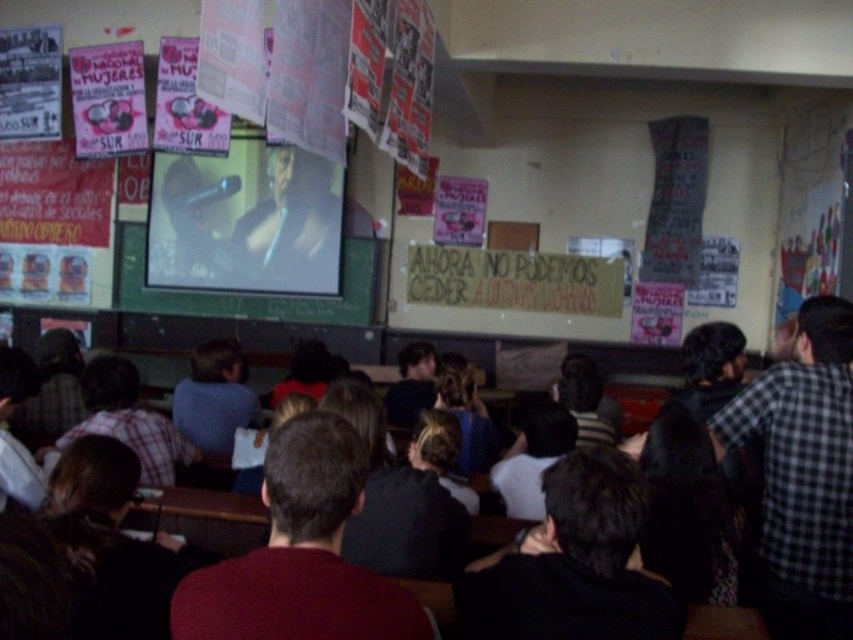
Question: Is checkered fabric shirt at right further to camera compared to smooth black shirt at center?

Choices:
 (A) yes
 (B) no

Answer: (B)

Question: Does dark red shirt at center have a greater width compared to matte pink poster at upper left?

Choices:
 (A) no
 (B) yes

Answer: (A)

Question: Does dark red shirt at center lie in front of matte pink poster at upper left?

Choices:
 (A) no
 (B) yes

Answer: (B)

Question: Which object is the farthest from the smooth black shirt at center?

Choices:
 (A) matte pink poster at upper left
 (B) checkered fabric shirt at right

Answer: (B)

Question: Which point is closer to the camera?

Choices:
 (A) (764, 499)
 (B) (316, 260)

Answer: (A)

Question: Considering the real-world distances, which object is closest to the dark red shirt at center?

Choices:
 (A) checkered fabric shirt at right
 (B) matte pink poster at upper left
 (C) smooth black shirt at center

Answer: (A)